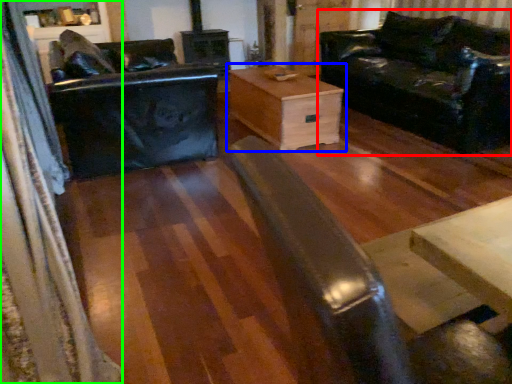
Question: Which is nearer to the studio couch (highlighted by a red box)? table (highlighted by a blue box) or curtain (highlighted by a green box).

Choices:
 (A) table
 (B) curtain

Answer: (A)